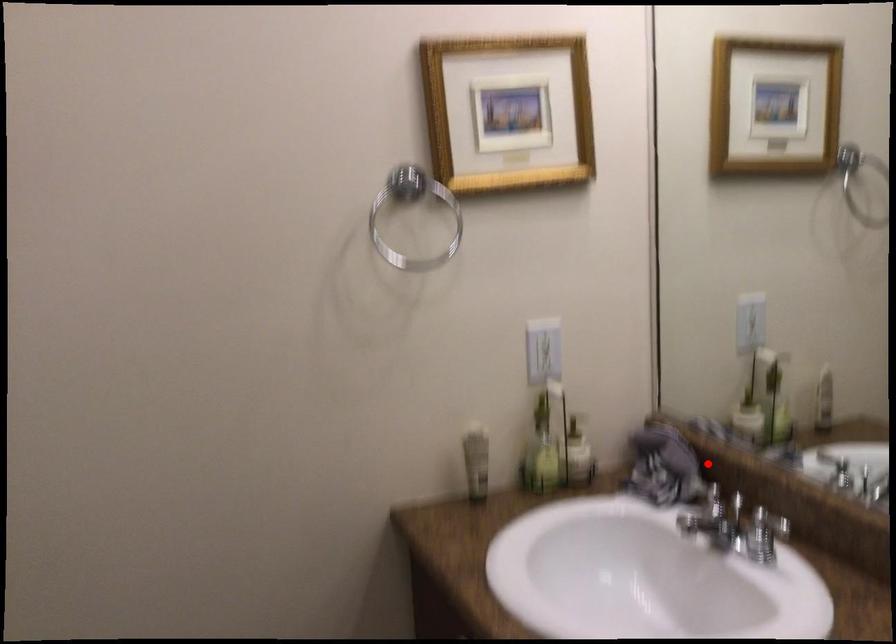
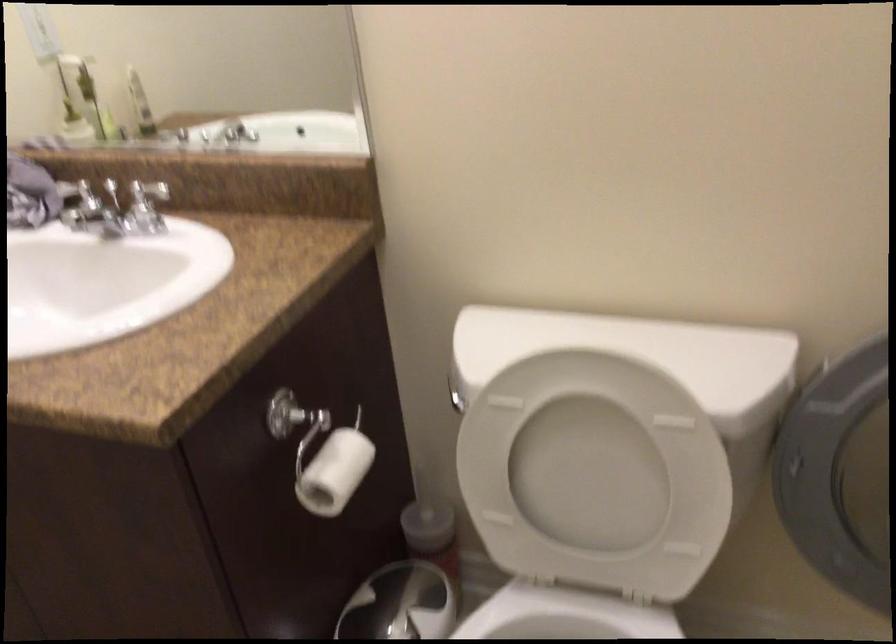
Question: I am providing you with two images of the same scene from different viewpoints. A red point is marked on the first image. Is the red point's position out of view in image 2?

Choices:
 (A) Yes
 (B) No

Answer: (B)